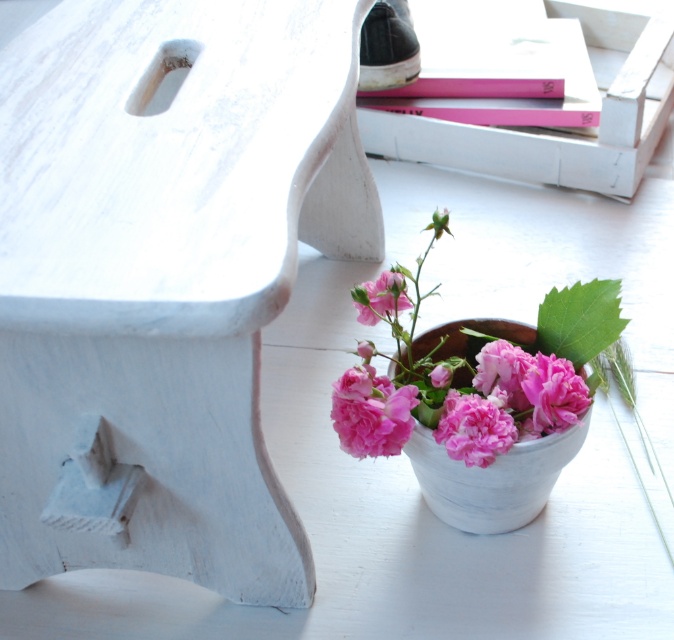
Question: Where is white glazed vase at lower right located in relation to matte pink petals at lower right in the image?

Choices:
 (A) above
 (B) below

Answer: (B)

Question: Can you confirm if matte pink flower at lower center is positioned to the right of pink matte flower at center?

Choices:
 (A) yes
 (B) no

Answer: (A)

Question: Which object is closer to the camera taking this photo?

Choices:
 (A) matte pink petals at lower right
 (B) matte pink flower at lower center
 (C) pink matte flower at lower center

Answer: (B)

Question: Can you confirm if pink matte flower at lower center is positioned below pink matte flower at center?

Choices:
 (A) no
 (B) yes

Answer: (B)

Question: Which object is farther from the camera taking this photo?

Choices:
 (A) white glazed vase at lower right
 (B) pink matte flower at center
 (C) suede black shoe at upper center

Answer: (C)

Question: Which object is the closest to the matte pink petals at lower right?

Choices:
 (A) pink matte flower at center
 (B) suede black shoe at upper center
 (C) white glazed vase at lower right

Answer: (C)